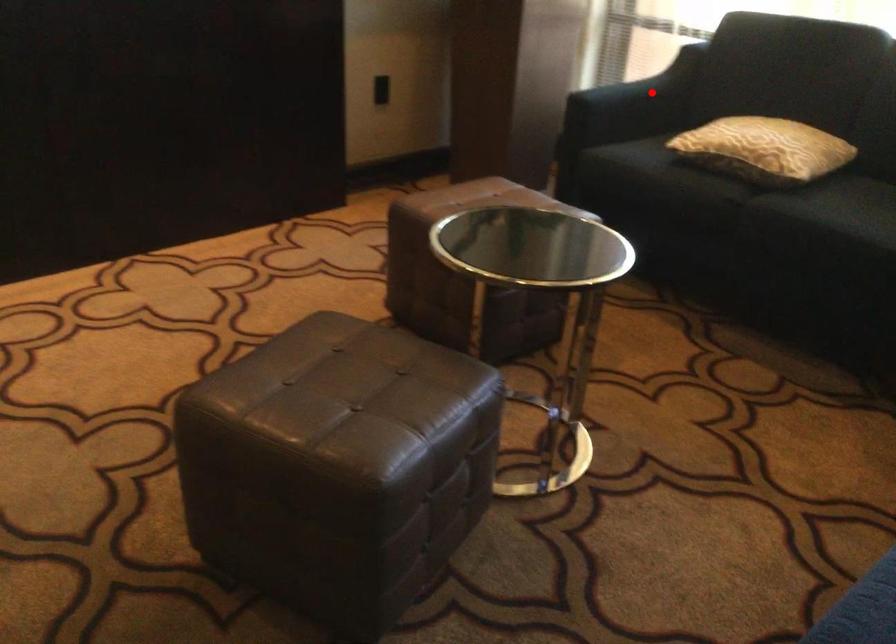
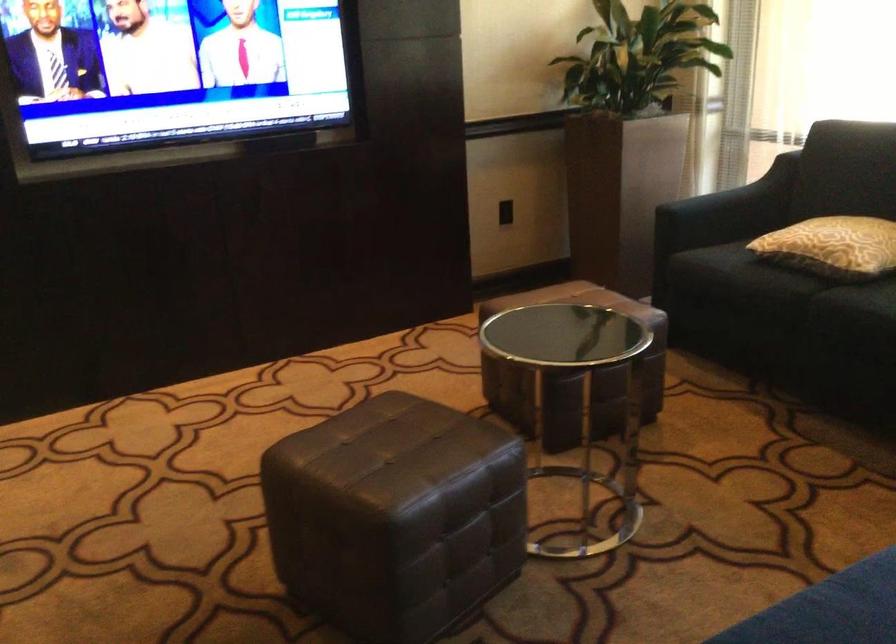
Where in the second image is the point corresponding to the highlighted location from the first image?

(742, 196)